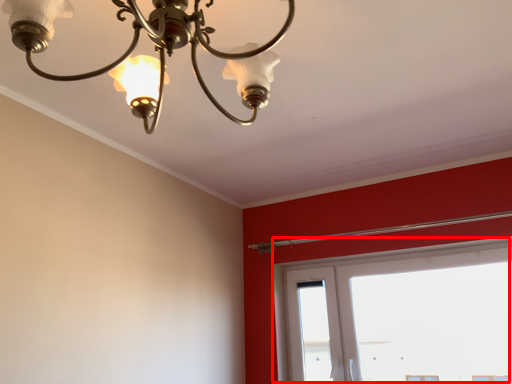
Question: In this image, where is window (annotated by the red box) located relative to lamp?

Choices:
 (A) right
 (B) left

Answer: (A)